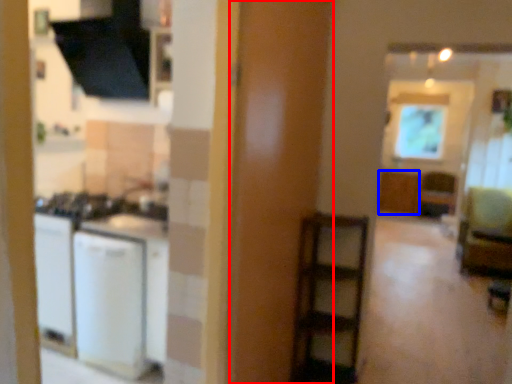
Question: Among these objects, which one is farthest to the camera, screen door (highlighted by a red box) or cabinetry (highlighted by a blue box)?

Choices:
 (A) screen door
 (B) cabinetry

Answer: (B)